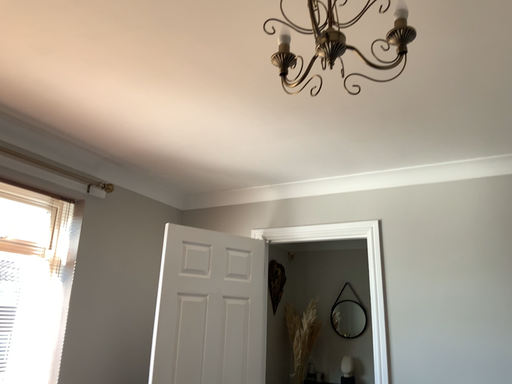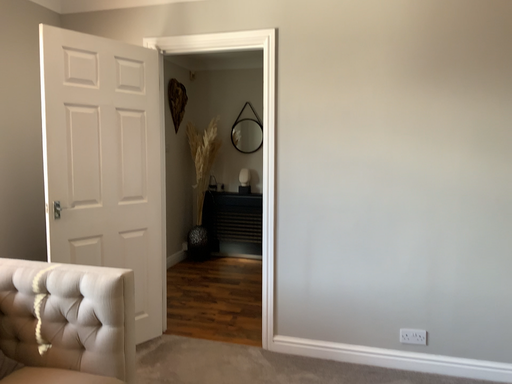
Question: How did the camera likely rotate when shooting the video?

Choices:
 (A) rotated left
 (B) rotated right

Answer: (B)